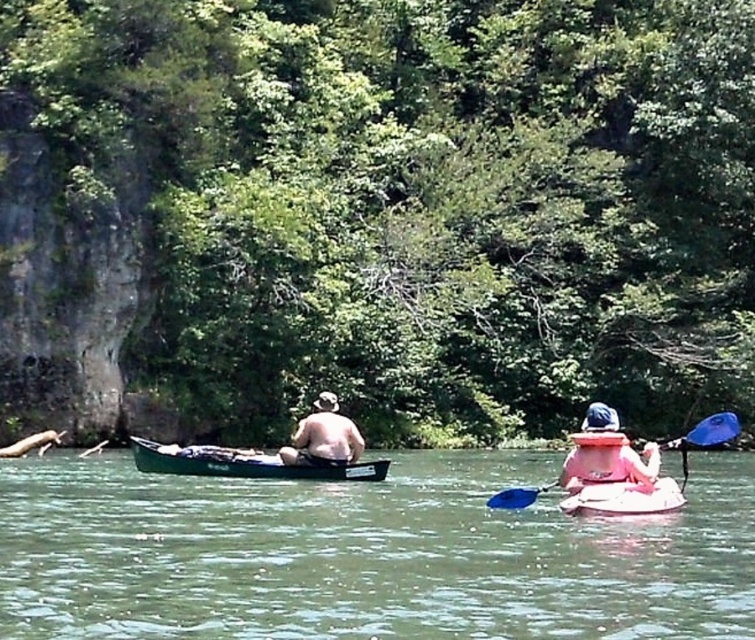
You are a kayaker planning to cross a 30 meter wide river. You see two kayakers at the coordinates point (713, 483). Can you safely cross the river between them?

The two kayakers at point (713, 483) are 30.88 meters apart. Since the river is 30 meters wide, the distance between them is sufficient to allow safe passage for your kayak.

You are standing on the dock and see a point marked at coordinates (365,554). Which object corresponds to this point?

The point at coordinates (365,554) corresponds to the green rubber boat at center.